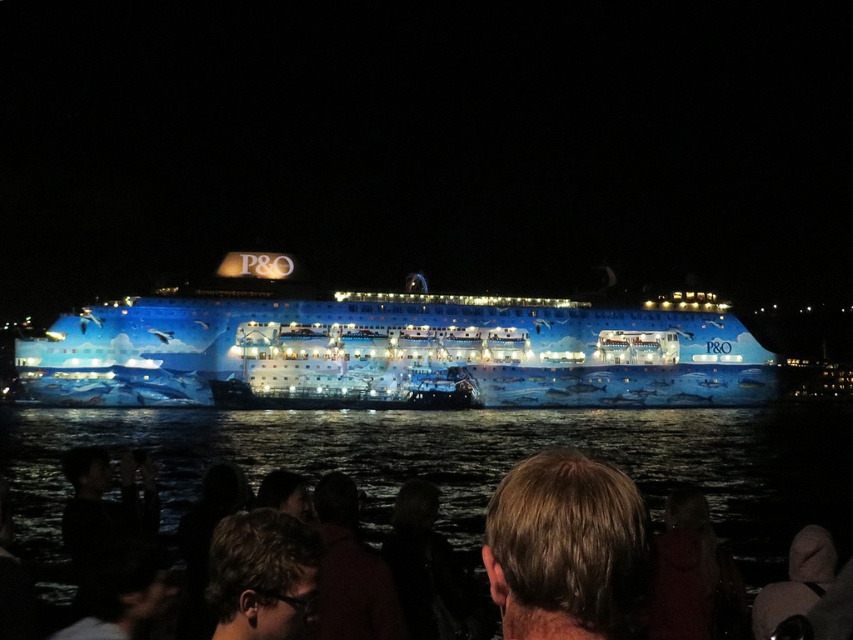
Question: Is blue glossy cruise ship at center positioned at the back of transparent water at lower center?

Choices:
 (A) yes
 (B) no

Answer: (A)

Question: Can you confirm if blue glossy cruise ship at center is thinner than light brown hair at lower center?

Choices:
 (A) no
 (B) yes

Answer: (A)

Question: Is transparent water at lower center smaller than blonde hair at center?

Choices:
 (A) yes
 (B) no

Answer: (B)

Question: Estimate the real-world distances between objects in this image. Which object is closer to the blue glossy cruise ship at center?

Choices:
 (A) transparent water at lower center
 (B) light brown hair at lower center
 (C) blonde hair at center

Answer: (A)

Question: Considering the real-world distances, which object is closest to the light brown hair at lower center?

Choices:
 (A) blue glossy cruise ship at center
 (B) blonde hair at center
 (C) transparent water at lower center

Answer: (B)

Question: Which point appears farthest from the camera in this image?

Choices:
 (A) (389, 378)
 (B) (242, 572)
 (C) (642, 525)
 (D) (842, 529)

Answer: (A)